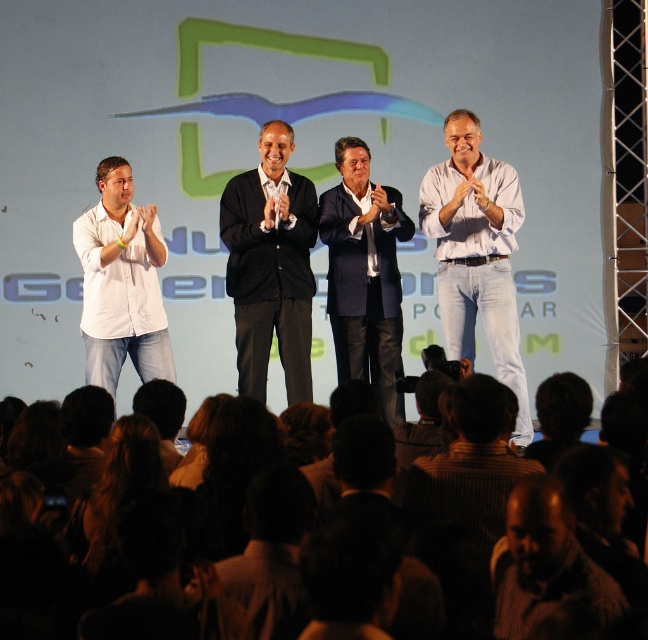
Based on the scene description, which object is shorter in height between the dark brown hair at lower center and the white matte shirt at left?

The dark brown hair at lower center is shorter than the white matte shirt at left according to the description.

You are organizing a group photo and need to arrange the navy blue suit at center and the striped shirt at lower right side by side. Based on their sizes, which one should be placed on the left to ensure they fit within the frame without overlapping?

The navy blue suit at center has a larger width than the striped shirt at lower right, so placing the navy blue suit at center on the left would allow both to fit within the frame without overlapping since it takes up more space.